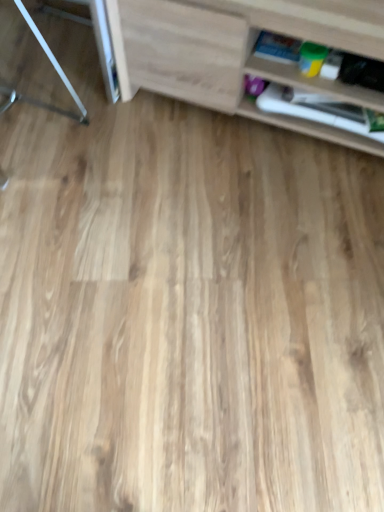
I want to click on vacant space underneath metallic silver table at left (from a real-world perspective), so [61, 70].